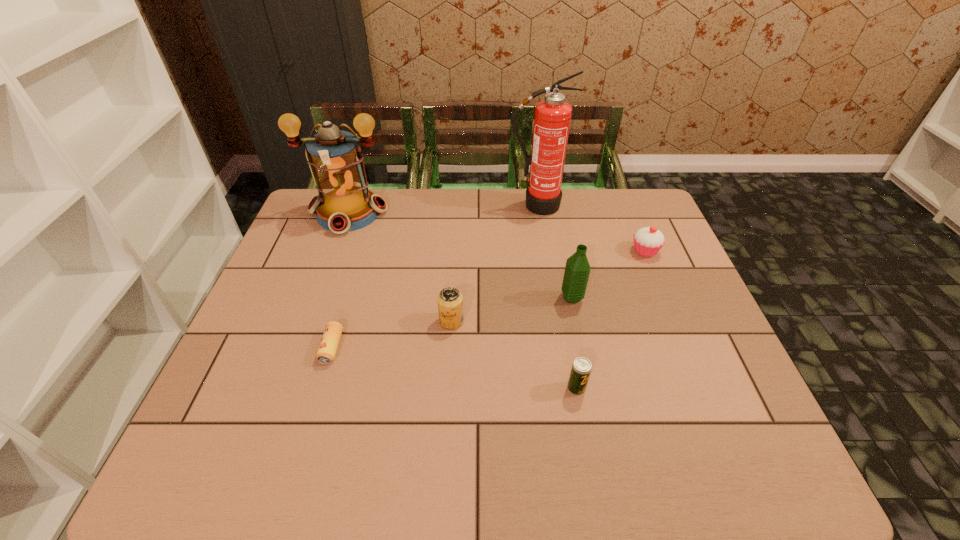
Find the location of a particular element. lantern that is positioned at the far edge is located at coordinates (344, 203).

Find the location of a particular element. The height and width of the screenshot is (540, 960). object located at the left edge is located at coordinates (344, 203).

Where is `object located in the right edge section of the desktop`? The width and height of the screenshot is (960, 540). object located in the right edge section of the desktop is located at coordinates (648, 241).

At what (x,y) coordinates should I click in order to perform the action: click on object situated at the far left corner. Please return your answer as a coordinate pair (x, y). The height and width of the screenshot is (540, 960). Looking at the image, I should click on (344, 203).

This screenshot has height=540, width=960. Identify the location of free spot at the far edge of the desktop. (396, 190).

Identify the location of vacant space at the near edge of the desktop. tap(556, 470).

Locate an element on the screen. The width and height of the screenshot is (960, 540). vacant point at the left edge is located at coordinates (305, 274).

Where is `vacant space at the far right corner of the desktop`? vacant space at the far right corner of the desktop is located at coordinates (639, 201).

In order to click on free space that is in between the third farthest object and the second nearest beer can in this screenshot , I will do `click(489, 299)`.

Locate an element on the screen. This screenshot has width=960, height=540. vacant space that is in between the fifth farthest object and the tallest object is located at coordinates (493, 264).